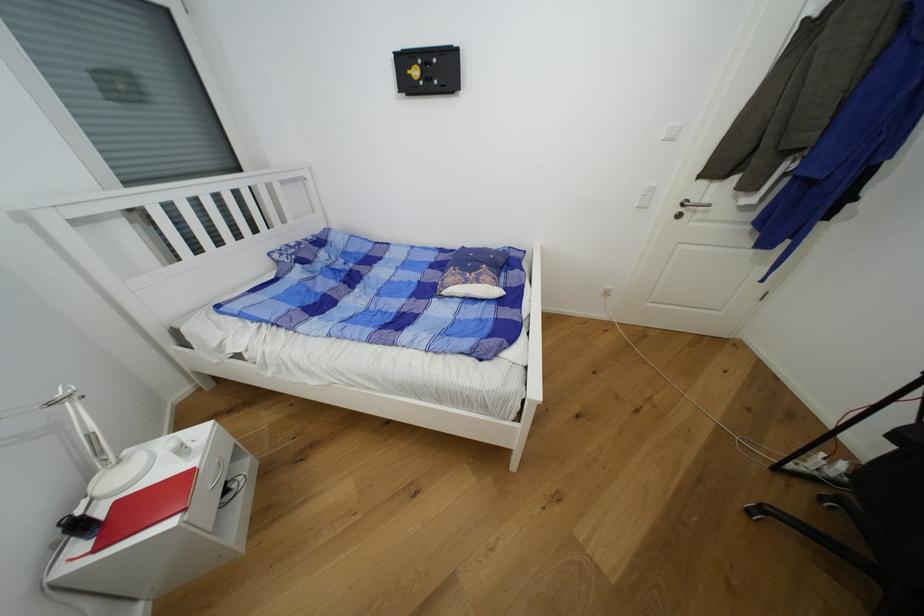
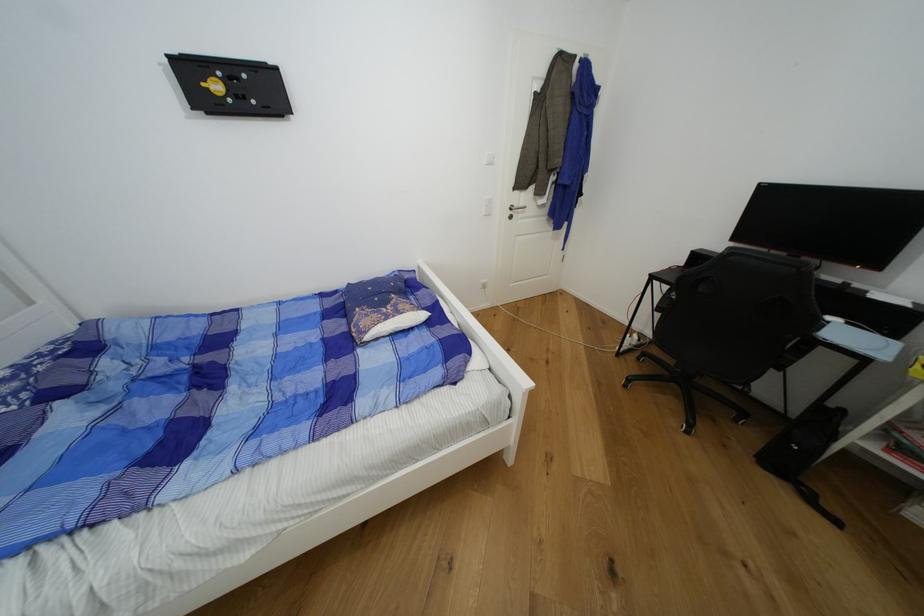
Question: Based on the continuous images, in which direction is the camera rotating? Reply with the corresponding letter.

Choices:
 (A) Left
 (B) Right
 (C) Up
 (D) Down

Answer: (B)